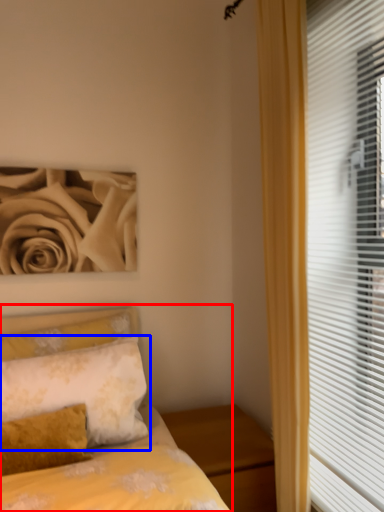
Question: Which of the following is the closest to the observer, bed (highlighted by a red box) or pillow (highlighted by a blue box)?

Choices:
 (A) bed
 (B) pillow

Answer: (A)